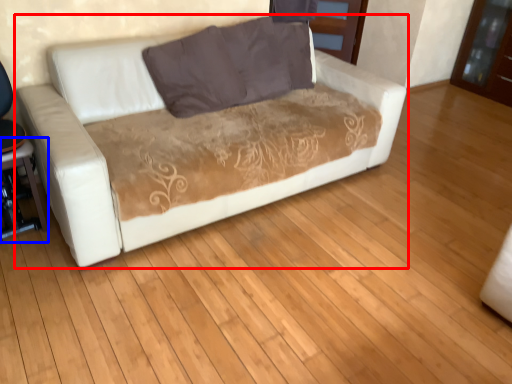
Question: Which object appears closest to the camera in this image, studio couch (highlighted by a red box) or table (highlighted by a blue box)?

Choices:
 (A) studio couch
 (B) table

Answer: (A)